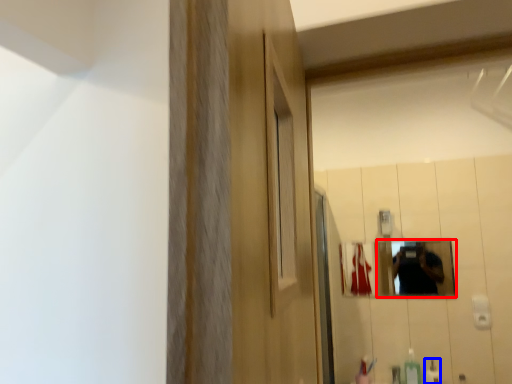
Question: Which of the following is the farthest to the observer, mirror (highlighted by a red box) or mouthwash (highlighted by a blue box)?

Choices:
 (A) mirror
 (B) mouthwash

Answer: (A)